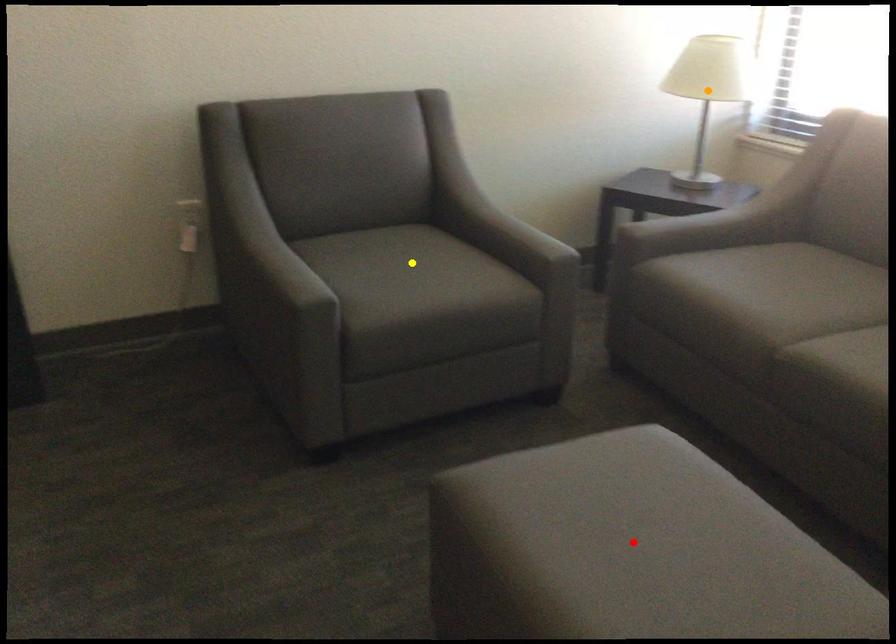
Order these from nearest to farthest:
orange point, red point, yellow point

red point, yellow point, orange point